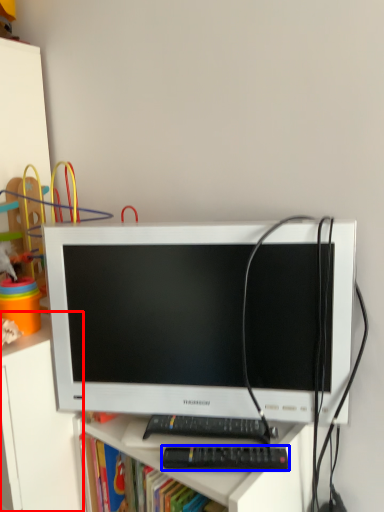
Question: Which object is closer to the camera taking this photo, file cabinet (highlighted by a red box) or control (highlighted by a blue box)?

Choices:
 (A) file cabinet
 (B) control

Answer: (B)